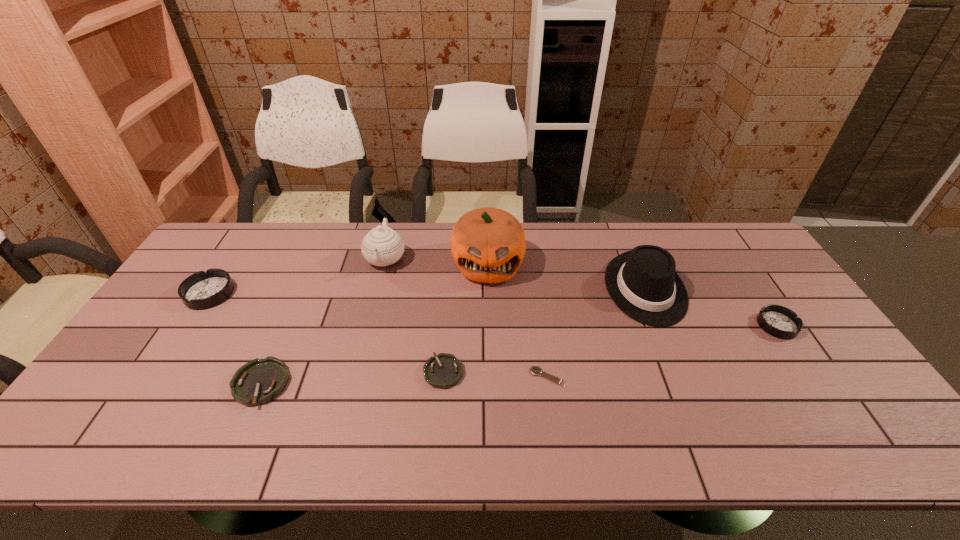
What are the coordinates of `free space located 0.070m on the front of the shortest object` in the screenshot? It's located at (552, 413).

You are a GUI agent. You are given a task and a screenshot of the screen. Output one action in this format:
    pyautogui.click(x=<x>, y=<y>)
    Task: Click on the pumpkin that is at the far edge
    The width and height of the screenshot is (960, 540).
    Given the screenshot: What is the action you would take?
    pyautogui.click(x=488, y=245)

The height and width of the screenshot is (540, 960). In order to click on chinaware that is at the far edge in this screenshot , I will do `click(382, 246)`.

I want to click on fedora at the far edge, so click(x=643, y=284).

This screenshot has height=540, width=960. Identify the location of object that is at the left edge. (202, 290).

Identify the location of object that is at the right edge. The image size is (960, 540). (778, 321).

The width and height of the screenshot is (960, 540). Find the location of `vacant space at the far edge of the desktop`. vacant space at the far edge of the desktop is located at coordinates (572, 228).

The image size is (960, 540). In the image, there is a desktop. Find the location of `blank space at the left edge`. blank space at the left edge is located at coordinates (152, 373).

The width and height of the screenshot is (960, 540). Find the location of `free space at the right edge`. free space at the right edge is located at coordinates (814, 382).

Find the location of a particular element. The image size is (960, 540). vacant position at the far left corner of the desktop is located at coordinates (222, 239).